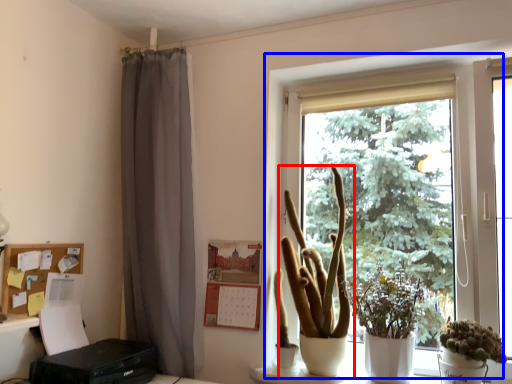
Question: Which object is closer to the camera taking this photo, houseplant (highlighted by a red box) or window (highlighted by a blue box)?

Choices:
 (A) houseplant
 (B) window

Answer: (B)